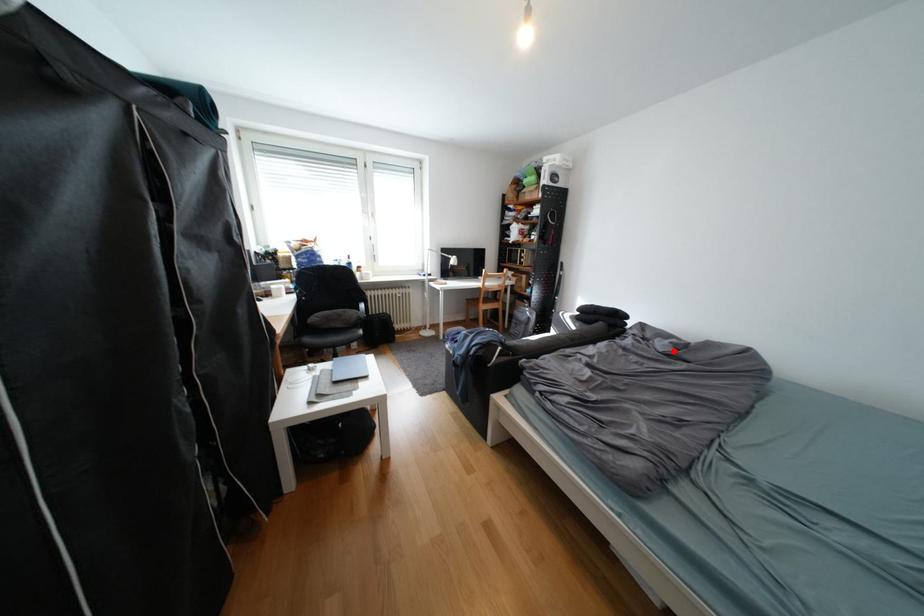
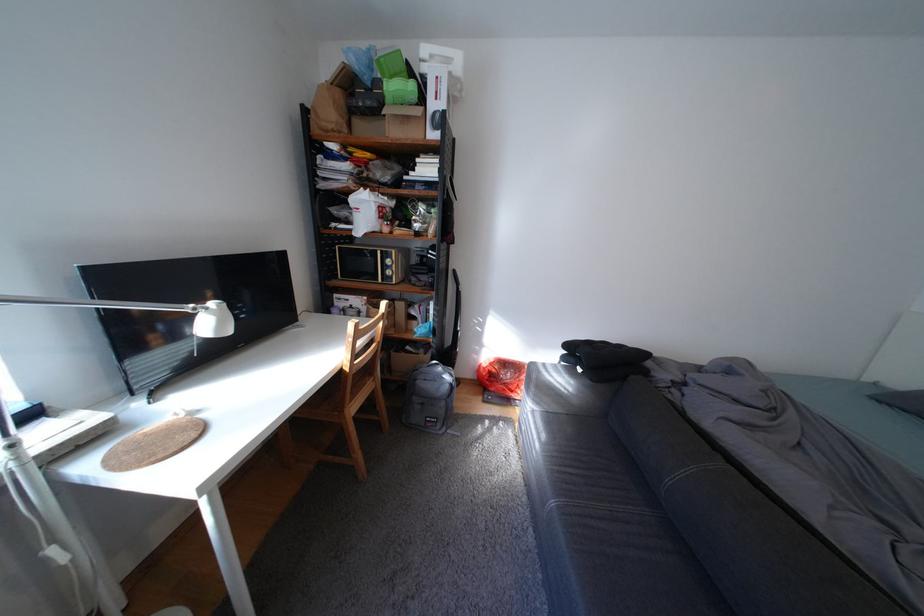
Where in the second image is the point corresponding to the highlighted location from the first image?

(773, 407)